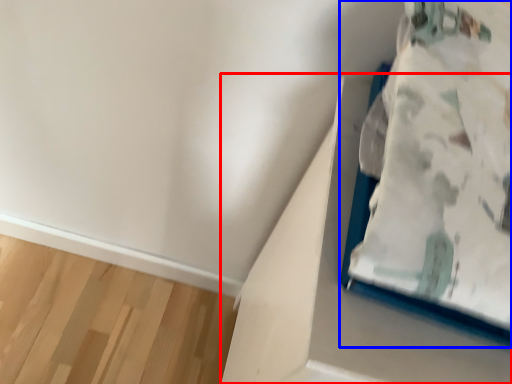
Question: Which object is further to the camera taking this photo, cardboard box (highlighted by a red box) or furniture (highlighted by a blue box)?

Choices:
 (A) cardboard box
 (B) furniture

Answer: (A)